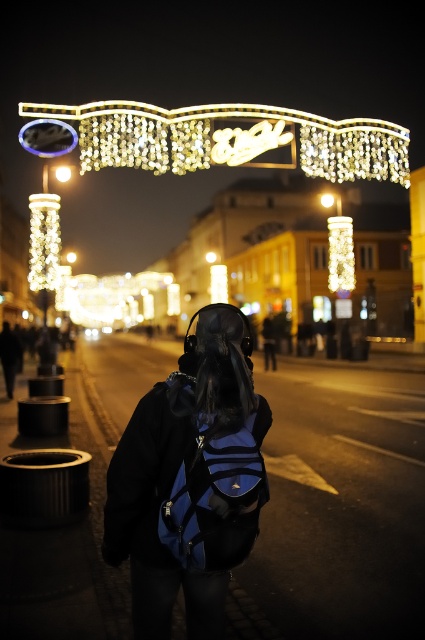
I want to click on iridescent glass arch at upper center, so click(223, 138).

Is iridescent glass arch at upper center thinner than illuminated glass column at left?

No, iridescent glass arch at upper center is not thinner than illuminated glass column at left.

The image size is (425, 640). Describe the element at coordinates (223, 138) in the screenshot. I see `iridescent glass arch at upper center` at that location.

In order to click on iridescent glass arch at upper center in this screenshot , I will do `click(223, 138)`.

Is illuminated glass column at left positioned in front of matte white light at center?

Yes, illuminated glass column at left is closer to the viewer.

Where is `illuminated glass column at left`? illuminated glass column at left is located at coordinates (44, 241).

Where is `blue fabric backpack at center`? Image resolution: width=425 pixels, height=640 pixels. blue fabric backpack at center is located at coordinates (189, 481).

From the picture: Can you confirm if blue fabric backpack at center is positioned below illuminated glass column at left?

Yes.

Is point (129, 513) positioned in front of point (36, 280)?

Yes.

Find the location of a particular element. blue fabric backpack at center is located at coordinates (189, 481).